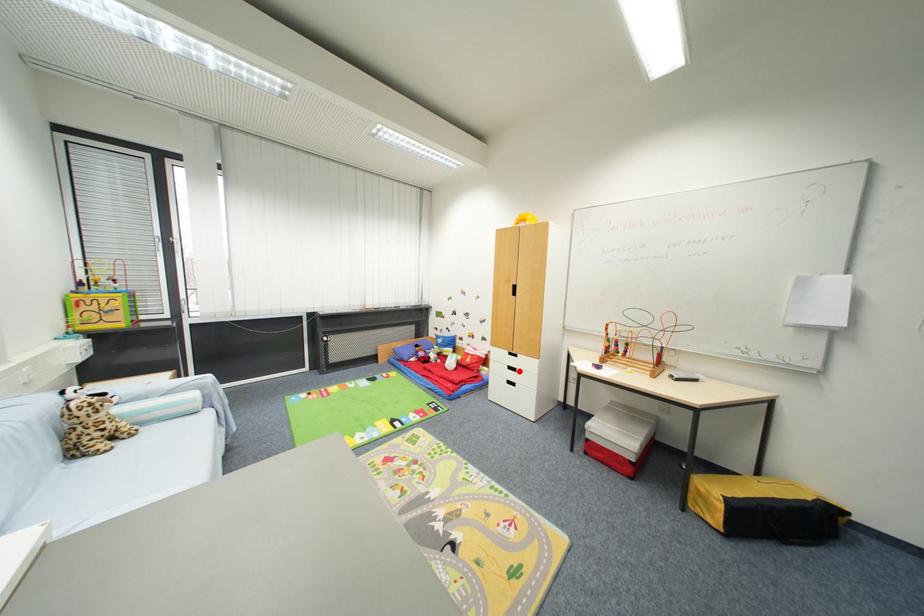
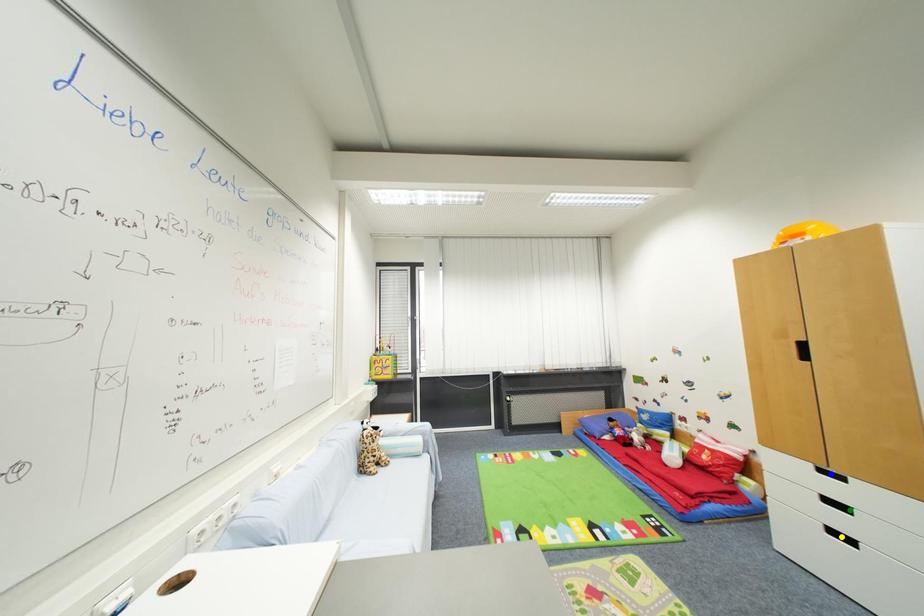
Question: I am providing you with two images of the same scene from different viewpoints. A red point is marked on the first image. You are given multiple points on the second image. Which mark in image 2 goes with the point in image 1?

Choices:
 (A) yellow point
 (B) green point
 (C) blue point

Answer: (B)